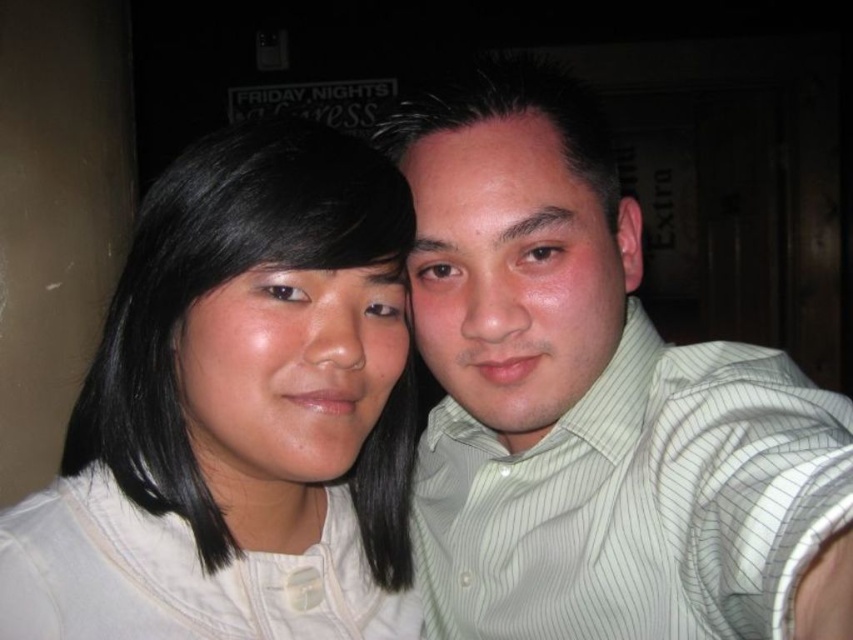
Which is above, white matte shirt at left or matte green shirt at center?

matte green shirt at center is higher up.

Find the location of a particular element. The image size is (853, 640). white matte shirt at left is located at coordinates (239, 412).

The height and width of the screenshot is (640, 853). In order to click on white matte shirt at left in this screenshot , I will do `click(239, 412)`.

Can you confirm if green striped shirt at right is smaller than matte white face at center?

No.

Who is more distant from viewer, (x=473, y=632) or (x=312, y=324)?

Point (x=473, y=632)

Locate an element on the screen. green striped shirt at right is located at coordinates (595, 403).

Where is `green striped shirt at right`? The height and width of the screenshot is (640, 853). green striped shirt at right is located at coordinates (595, 403).

Can you confirm if white matte shirt at left is smaller than matte white face at center?

No, white matte shirt at left is not smaller than matte white face at center.

Between point (265, 307) and point (184, 374), which one is positioned behind?

Point (184, 374)

The width and height of the screenshot is (853, 640). What do you see at coordinates (239, 412) in the screenshot? I see `white matte shirt at left` at bounding box center [239, 412].

Locate an element on the screen. The width and height of the screenshot is (853, 640). white matte shirt at left is located at coordinates (239, 412).